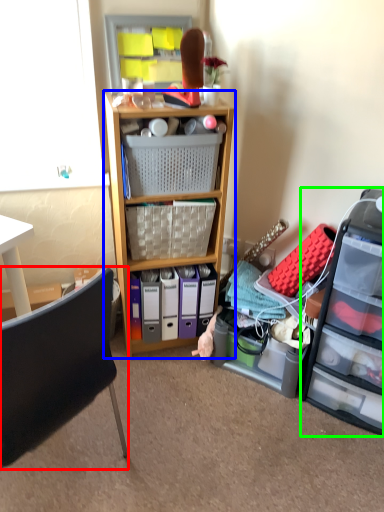
Question: Estimate the real-world distances between objects in this image. Which object is farther from chair (highlighted by a red box), shelf (highlighted by a blue box) or file cabinet (highlighted by a green box)?

Choices:
 (A) shelf
 (B) file cabinet

Answer: (B)